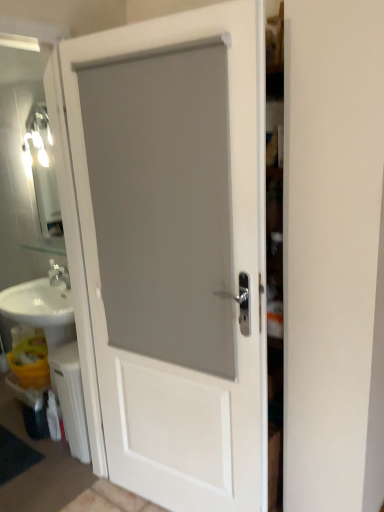
Question: From a real-world perspective, is white plastic radiator at lower left on top of white matte door at center?

Choices:
 (A) no
 (B) yes

Answer: (A)

Question: Can you confirm if white plastic radiator at lower left is bigger than white matte door at center?

Choices:
 (A) no
 (B) yes

Answer: (A)

Question: From the image's perspective, is white plastic radiator at lower left over white matte door at center?

Choices:
 (A) yes
 (B) no

Answer: (B)

Question: Does white plastic radiator at lower left have a greater height compared to white matte door at center?

Choices:
 (A) yes
 (B) no

Answer: (B)

Question: Does white plastic radiator at lower left appear on the right side of white matte door at center?

Choices:
 (A) yes
 (B) no

Answer: (B)

Question: Is white matte door at center at the back of white plastic radiator at lower left?

Choices:
 (A) yes
 (B) no

Answer: (B)

Question: Is white matte door at center not inside white plastic radiator at lower left?

Choices:
 (A) yes
 (B) no

Answer: (A)

Question: Does white matte door at center appear on the left side of white plastic radiator at lower left?

Choices:
 (A) yes
 (B) no

Answer: (B)

Question: Considering the relative positions of white matte door at center and white plastic radiator at lower left in the image provided, is white matte door at center to the right of white plastic radiator at lower left from the viewer's perspective?

Choices:
 (A) yes
 (B) no

Answer: (A)

Question: Is white plastic radiator at lower left inside white matte door at center?

Choices:
 (A) yes
 (B) no

Answer: (B)

Question: Can you confirm if white matte door at center is taller than white plastic radiator at lower left?

Choices:
 (A) yes
 (B) no

Answer: (A)

Question: Is white matte door at center in front of white plastic radiator at lower left?

Choices:
 (A) yes
 (B) no

Answer: (A)

Question: Is white plastic radiator at lower left to the left or to the right of white matte door at center in the image?

Choices:
 (A) right
 (B) left

Answer: (B)